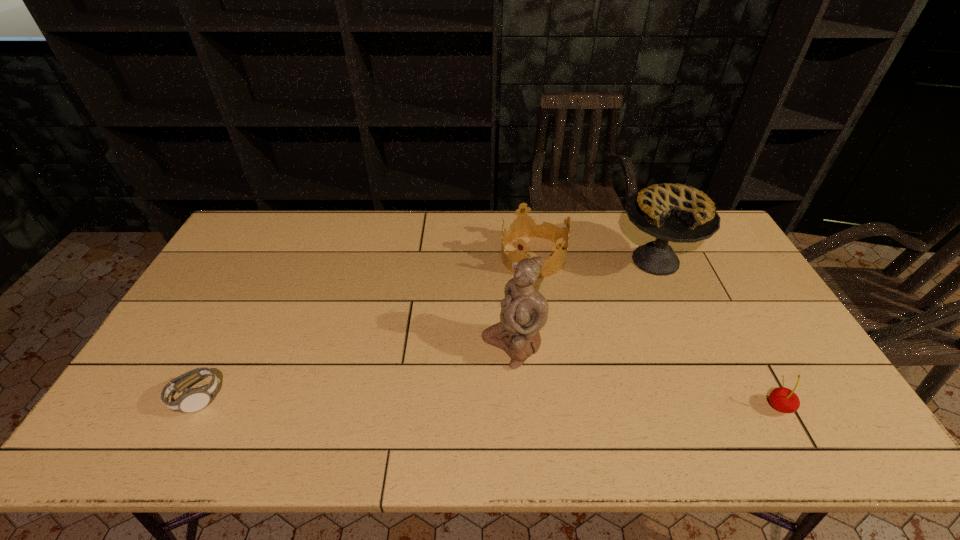
You are a GUI agent. You are given a task and a screenshot of the screen. Output one action in this format:
    pyautogui.click(x=<x>, y=<y>)
    Task: Click on the vacant space at the right edge of the desktop
    The width and height of the screenshot is (960, 540).
    Given the screenshot: What is the action you would take?
    pyautogui.click(x=730, y=278)

The image size is (960, 540). In order to click on blank space at the far left corner of the desktop in this screenshot , I will do `click(251, 224)`.

This screenshot has width=960, height=540. I want to click on free space at the near left corner of the desktop, so click(x=150, y=407).

I want to click on empty space between the second shortest object and the third farthest object, so click(645, 376).

The height and width of the screenshot is (540, 960). In order to click on unoccupied position between the third farthest object and the pie in this screenshot , I will do `click(584, 303)`.

Find the location of a particular element. This screenshot has width=960, height=540. vacant region between the pie and the third nearest object is located at coordinates (584, 303).

At what (x,y) coordinates should I click in order to perform the action: click on vacant point located between the cherry and the pie. Please return your answer as a coordinate pair (x, y). The height and width of the screenshot is (540, 960). Looking at the image, I should click on (717, 334).

Locate an element on the screen. This screenshot has height=540, width=960. blank region between the second shortest object and the third farthest object is located at coordinates (645, 376).

Where is `blank region between the third shortest object and the leftmost object`? This screenshot has width=960, height=540. blank region between the third shortest object and the leftmost object is located at coordinates (365, 327).

The width and height of the screenshot is (960, 540). Find the location of `free space between the pie and the figurine`. free space between the pie and the figurine is located at coordinates click(584, 303).